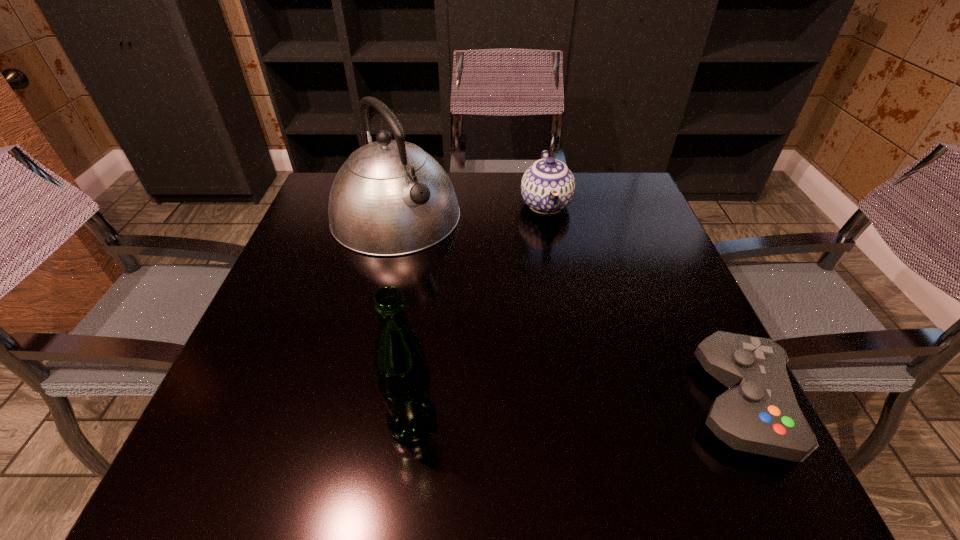
The image size is (960, 540). What are the coordinates of `beer bottle` in the screenshot? It's located at (403, 377).

You are a GUI agent. You are given a task and a screenshot of the screen. Output one action in this format:
    pyautogui.click(x=<x>, y=<y>)
    Task: Click on the rightmost object
    
    Given the screenshot: What is the action you would take?
    pyautogui.click(x=759, y=413)

This screenshot has width=960, height=540. In order to click on the shortest object in this screenshot , I will do `click(759, 413)`.

I want to click on chinaware, so click(548, 186).

The height and width of the screenshot is (540, 960). Identify the location of the third object from left to right. (548, 186).

Identify the location of kettle. [390, 198].

Where is `vacant space located 0.250m on the back of the beer bottle`? This screenshot has height=540, width=960. vacant space located 0.250m on the back of the beer bottle is located at coordinates (427, 296).

Locate an element on the screen. vacant space located on the left of the control is located at coordinates (572, 403).

Identify the location of blank space located 0.290m at the spout of the second shortest object. The width and height of the screenshot is (960, 540). (569, 318).

Where is `vacant space located 0.060m at the spout of the second shortest object`? vacant space located 0.060m at the spout of the second shortest object is located at coordinates (554, 246).